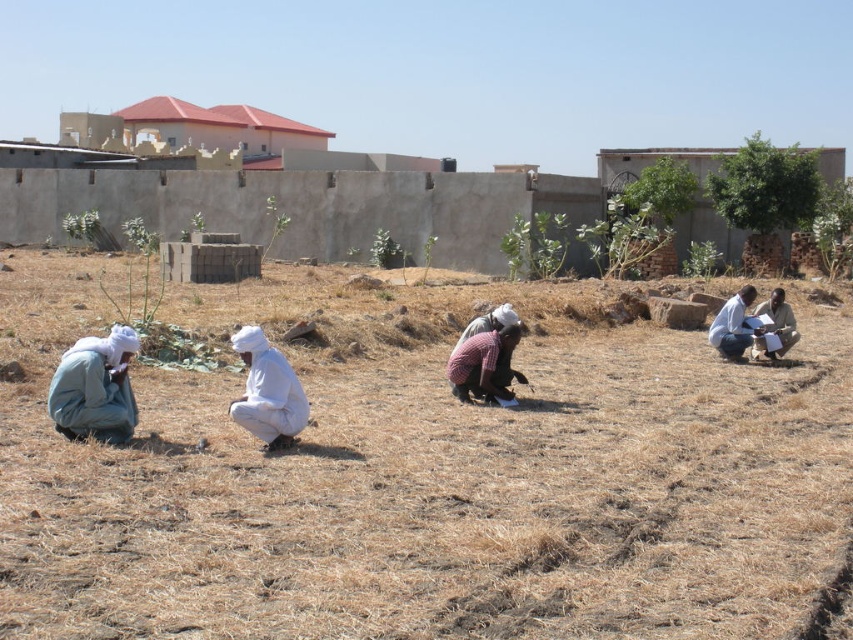
You are a photographer trying to capture the scene with the brown dry grass at center and the light gray fabric at left. Which object should you focus on first if you want to ensure both are in sharp focus?

The brown dry grass at center should be focused on first because it is positioned over the light gray fabric at left, meaning it is closer to the camera. By focusing on the closer object, the background object will also be in focus due to the depth of field.